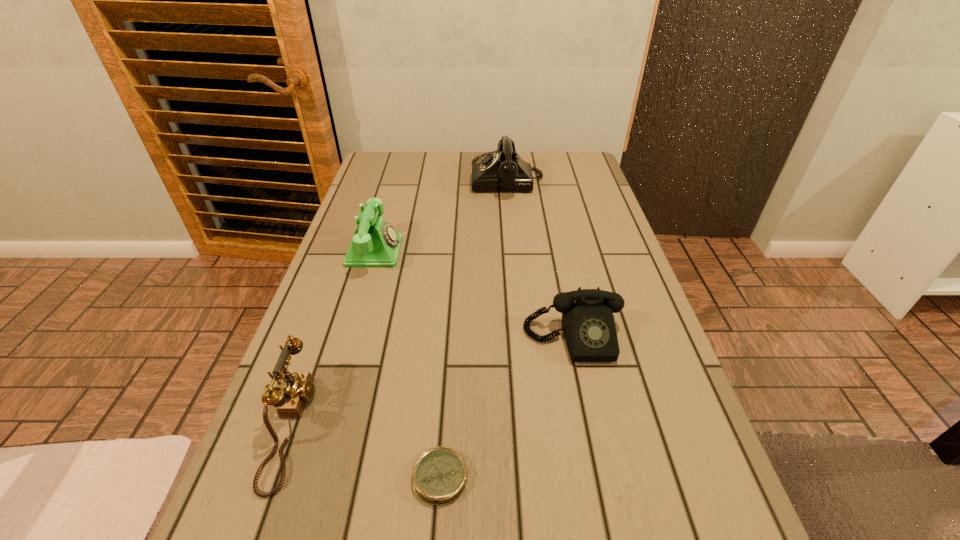
The image size is (960, 540). Find the location of `free space between the fourth tallest object and the nearest telephone`. free space between the fourth tallest object and the nearest telephone is located at coordinates (432, 382).

Image resolution: width=960 pixels, height=540 pixels. I want to click on free area in between the farthest object and the shortest telephone, so click(540, 259).

Where is `free space between the shortest object and the fourth tallest object`? free space between the shortest object and the fourth tallest object is located at coordinates (507, 408).

I want to click on free space between the second farthest telephone and the farthest telephone, so pos(441,215).

Locate an element on the screen. The height and width of the screenshot is (540, 960). free space between the second farthest telephone and the nearest telephone is located at coordinates (333, 339).

At what (x,y) coordinates should I click in order to perform the action: click on free space between the compass and the second farthest object. Please return your answer as a coordinate pair (x, y). Looking at the image, I should click on (408, 364).

In order to click on vacant space that is in between the shortest object and the nearest telephone in this screenshot , I will do `click(366, 451)`.

I want to click on free space between the nearest telephone and the third nearest telephone, so click(333, 339).

The image size is (960, 540). What are the coordinates of `vacant space that is in between the shortest object and the second farthest telephone` in the screenshot? It's located at (408, 364).

The image size is (960, 540). I want to click on the closest object to the shortest object, so click(x=298, y=388).